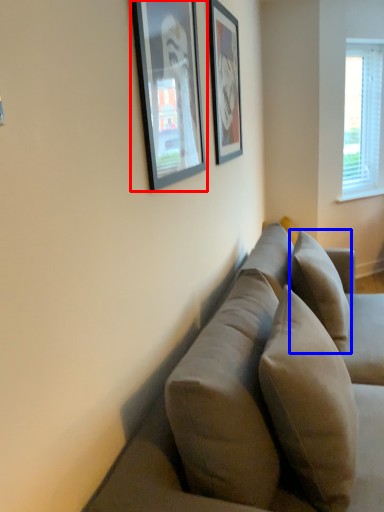
Question: Which of the following is the closest to the observer, picture frame (highlighted by a red box) or pillow (highlighted by a blue box)?

Choices:
 (A) picture frame
 (B) pillow

Answer: (A)